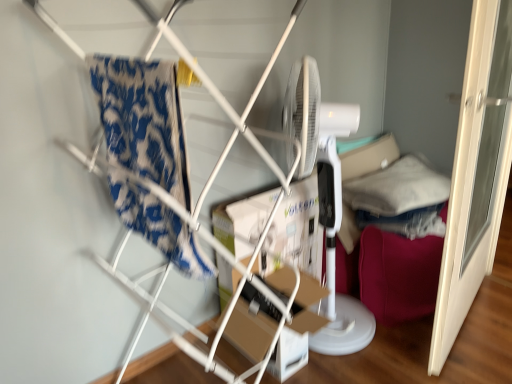
Question: Would you say white plastic mechanical fan at right is to the left or to the right of cardboard box at center in the picture?

Choices:
 (A) left
 (B) right

Answer: (B)

Question: Relative to cardboard box at center, is white plastic mechanical fan at right in front or behind?

Choices:
 (A) front
 (B) behind

Answer: (A)

Question: Which of these objects is positioned farthest from the cardboard box at center?

Choices:
 (A) blue patterned fabric at left
 (B) soft white pillow at right
 (C) velvet pink bean bag chair at right
 (D) white plastic mechanical fan at right

Answer: (A)

Question: Based on their relative distances, which object is nearer to the white plastic mechanical fan at right?

Choices:
 (A) soft white pillow at right
 (B) blue patterned fabric at left
 (C) velvet pink bean bag chair at right
 (D) cardboard box at center

Answer: (C)